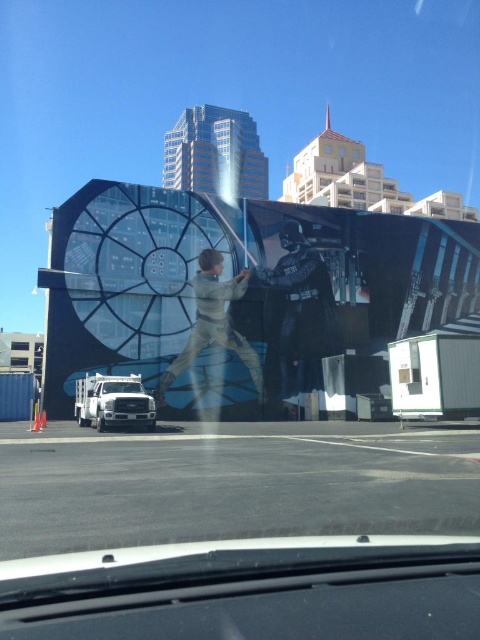
Consider the image. Does metallic silver armor at center have a smaller size compared to white matte truck at center?

Yes, metallic silver armor at center is smaller than white matte truck at center.

Who is lower down, metallic silver armor at center or white matte truck at center?

white matte truck at center is lower down.

Between point (300, 304) and point (80, 380), which one is positioned in front?

Point (80, 380)

The height and width of the screenshot is (640, 480). I want to click on metallic silver armor at center, so click(x=298, y=316).

Does light brown fabric at center have a lesser height compared to white matte truck at center?

No.

Does point (228, 323) come behind point (91, 417)?

That is True.

Find the location of `light brown fabric at center`. light brown fabric at center is located at coordinates (214, 323).

At what (x,y) coordinates should I click in order to perform the action: click on light brown fabric at center. Please return your answer as a coordinate pair (x, y). Looking at the image, I should click on (214, 323).

Does metallic silver armor at center have a greater width compared to light brown fabric at center?

In fact, metallic silver armor at center might be narrower than light brown fabric at center.

Which is more to the right, metallic silver armor at center or light brown fabric at center?

metallic silver armor at center

The image size is (480, 640). What do you see at coordinates (298, 316) in the screenshot? I see `metallic silver armor at center` at bounding box center [298, 316].

You are a GUI agent. You are given a task and a screenshot of the screen. Output one action in this format:
    pyautogui.click(x=<x>, y=<y>)
    Task: Click on the metallic silver armor at center
    
    Given the screenshot: What is the action you would take?
    pyautogui.click(x=298, y=316)